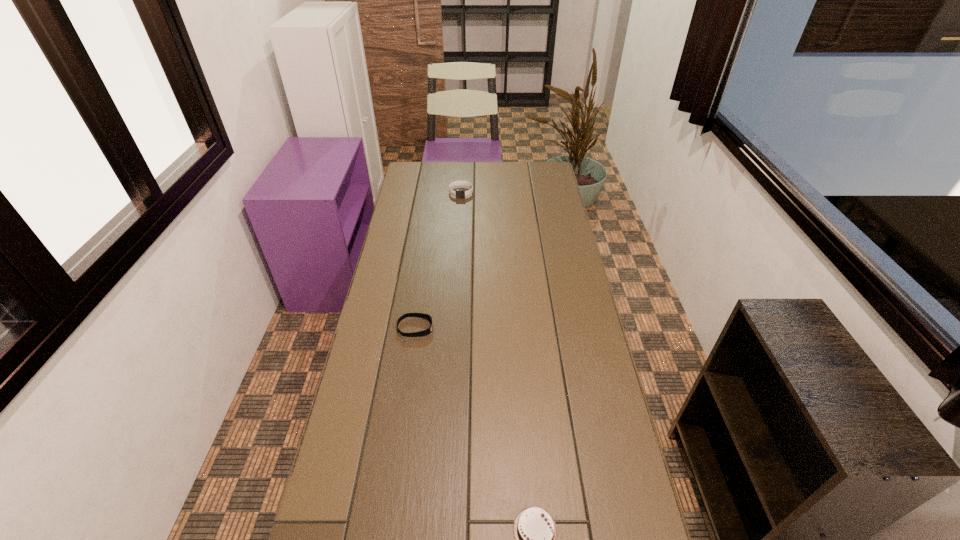
What are the coordinates of `vacant point located between the taller wristband and the nearer wristband` in the screenshot? It's located at (439, 260).

You are a GUI agent. You are given a task and a screenshot of the screen. Output one action in this format:
    pyautogui.click(x=<x>, y=<y>)
    Task: Click on the object that can be found as the second closest to the nearest object
    This screenshot has width=960, height=540.
    Given the screenshot: What is the action you would take?
    pyautogui.click(x=458, y=193)

Locate an element on the screen. The image size is (960, 540). the closest object to the farther wristband is located at coordinates click(420, 315).

The image size is (960, 540). I want to click on free location that satisfies the following two spatial constraints: 1. on the outer surface of the taller wristband; 2. on the display of the shorter wristband, so click(453, 328).

Image resolution: width=960 pixels, height=540 pixels. I want to click on free space that satisfies the following two spatial constraints: 1. on the outer surface of the tallest object; 2. on the display of the shorter wristband, so click(x=453, y=328).

Where is `vacant point that satisfies the following two spatial constraints: 1. on the outer surface of the tallest object; 2. on the display of the leftmost object`? This screenshot has height=540, width=960. vacant point that satisfies the following two spatial constraints: 1. on the outer surface of the tallest object; 2. on the display of the leftmost object is located at coordinates (453, 328).

In order to click on free point that satisfies the following two spatial constraints: 1. on the outer surface of the farther wristband; 2. on the display of the nearer wristband in this screenshot , I will do `click(453, 328)`.

You are a GUI agent. You are given a task and a screenshot of the screen. Output one action in this format:
    pyautogui.click(x=<x>, y=<y>)
    Task: Click on the free region that satisfies the following two spatial constraints: 1. on the outer surface of the farthest object; 2. on the display of the left wristband
    Image resolution: width=960 pixels, height=540 pixels.
    Given the screenshot: What is the action you would take?
    pyautogui.click(x=453, y=328)